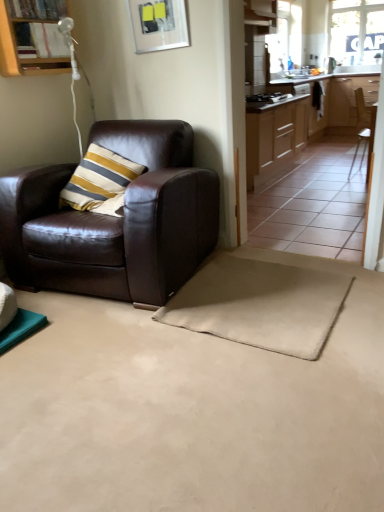
Identify the location of free space in front of shiny brown leather armchair at left, which is counted as the 1th chair, starting from the front. The width and height of the screenshot is (384, 512). (133, 369).